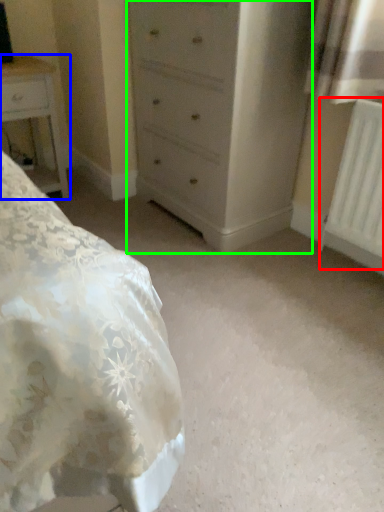
Question: Which object is positioned farthest from radiator (highlighted by a red box)? Select from nightstand (highlighted by a blue box) and chest of drawers (highlighted by a green box).

Choices:
 (A) nightstand
 (B) chest of drawers

Answer: (A)